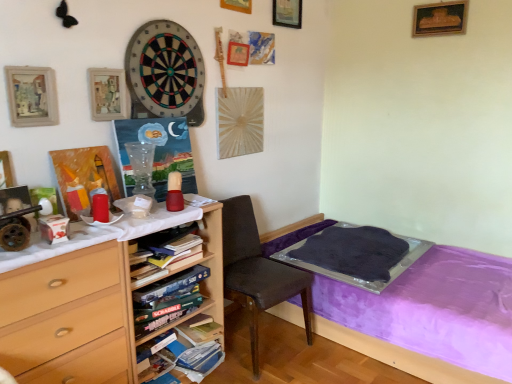
What is the approximate height of brown fabric chair at center?

The height of brown fabric chair at center is 30.53 inches.

This screenshot has width=512, height=384. Describe the element at coordinates (195, 348) in the screenshot. I see `hardcover book at center, which is counted as the second book, starting from the top` at that location.

Find the location of a particular element. The image size is (512, 384). wooden picture frame at upper right, which is counted as the 5th picture frame, starting from the left is located at coordinates tap(440, 18).

How different are the orientations of purple fabric bed at lower right and wooden picture frame at upper right, the fourth picture frame from the front, in degrees?

90.4 degrees.

From the image's perspective, which object appears higher, purple fabric bed at lower right or wooden picture frame at upper right, which is counted as the 5th picture frame, starting from the left?

From the image's view, wooden picture frame at upper right, which is counted as the 5th picture frame, starting from the left, is above.

Does purple fabric bed at lower right have a greater width compared to wooden picture frame at upper right, which is counted as the 5th picture frame, starting from the left?

Indeed, purple fabric bed at lower right has a greater width compared to wooden picture frame at upper right, which is counted as the 5th picture frame, starting from the left.

Is purple fabric bed at lower right at the right side of wooden picture frame at upper right, placed as the third picture frame when sorted from bottom to top?

Incorrect, purple fabric bed at lower right is not on the right side of wooden picture frame at upper right, placed as the third picture frame when sorted from bottom to top.

Which of these two, wooden picture frame at upper center, acting as the 3th picture frame starting from the left, or wooden desk at left, stands taller?

wooden desk at left is taller.

Consider the image. How far apart are wooden picture frame at upper center, the 4th picture frame ordered from the bottom, and wooden desk at left?

wooden picture frame at upper center, the 4th picture frame ordered from the bottom, and wooden desk at left are 5.52 feet apart from each other.

From a real-world perspective, is wooden picture frame at upper center, which is counted as the second picture frame, starting from the top, physically above wooden desk at left?

Yes, from a real-world perspective, wooden picture frame at upper center, which is counted as the second picture frame, starting from the top, is on top of wooden desk at left.

Considering the sizes of wooden picture frame at upper center, acting as the 3th picture frame starting from the left, and wooden desk at left in the image, is wooden picture frame at upper center, acting as the 3th picture frame starting from the left, wider or thinner than wooden desk at left?

In the image, wooden picture frame at upper center, acting as the 3th picture frame starting from the left, appears to be more narrow than wooden desk at left.

Is hardcover book at center, which is the first book from bottom to top, spatially inside wooden picture frame at upper left, the 5th picture frame from the back, or outside of it?

hardcover book at center, which is the first book from bottom to top, is spatially situated outside wooden picture frame at upper left, the 5th picture frame from the back.

Does hardcover book at center, which is the first book from bottom to top, have a lesser width compared to wooden picture frame at upper left, placed as the 1th picture frame when sorted from left to right?

In fact, hardcover book at center, which is the first book from bottom to top, might be wider than wooden picture frame at upper left, placed as the 1th picture frame when sorted from left to right.

How different are the orientations of hardcover book at center, which is counted as the second book, starting from the top, and wooden picture frame at upper left, acting as the 1th picture frame starting from the front, in degrees?

There is a 0.342-degree angle between the facing directions of hardcover book at center, which is counted as the second book, starting from the top, and wooden picture frame at upper left, acting as the 1th picture frame starting from the front.

Is hardcover book at center, which is counted as the second book, starting from the top, positioned with its back to wooden picture frame at upper left, acting as the 1th picture frame starting from the front?

No, hardcover book at center, which is counted as the second book, starting from the top, is not facing away from wooden picture frame at upper left, acting as the 1th picture frame starting from the front.

Does wooden picture frame at upper center, acting as the 3th picture frame starting from the left, have a greater height compared to soft felt dartboard at upper center?

No, wooden picture frame at upper center, acting as the 3th picture frame starting from the left, is not taller than soft felt dartboard at upper center.

Based on the photo, measure the distance from wooden picture frame at upper center, acting as the 3th picture frame starting from the left, to soft felt dartboard at upper center.

wooden picture frame at upper center, acting as the 3th picture frame starting from the left, is 21.66 inches away from soft felt dartboard at upper center.

Is wooden picture frame at upper center, the 3th picture frame positioned from the back, aimed at soft felt dartboard at upper center?

No, wooden picture frame at upper center, the 3th picture frame positioned from the back, is not aimed at soft felt dartboard at upper center.

Is point (165, 59) closer or farther from the camera than point (44, 100)?

Point (165, 59) is positioned farther from the camera compared to point (44, 100).

From a real-world perspective, is soft felt dartboard at upper center positioned over wooden picture frame at upper left, positioned as the 5th picture frame in top-to-bottom order, based on gravity?

Yes, from a real-world perspective, soft felt dartboard at upper center is on top of wooden picture frame at upper left, positioned as the 5th picture frame in top-to-bottom order.

Based on the photo, considering the relative positions of soft felt dartboard at upper center and wooden picture frame at upper left, acting as the 1th picture frame starting from the front, in the image provided, is soft felt dartboard at upper center behind wooden picture frame at upper left, acting as the 1th picture frame starting from the front,?

Yes, the depth of soft felt dartboard at upper center is greater than that of wooden picture frame at upper left, acting as the 1th picture frame starting from the front.

Measure the distance between soft felt dartboard at upper center and wooden picture frame at upper left, marked as the fifth picture frame in a right-to-left arrangement.

soft felt dartboard at upper center and wooden picture frame at upper left, marked as the fifth picture frame in a right-to-left arrangement, are 19.78 inches apart.

Does matte white box at left have a greater height compared to wooden desk at left?

No, matte white box at left is not taller than wooden desk at left.

Which point is more distant from viewer, (59, 224) or (156, 335)?

Point (156, 335)

In the scene shown: Based on their sizes in the image, would you say matte white box at left is bigger or smaller than wooden desk at left?

matte white box at left is smaller than wooden desk at left.

Image resolution: width=512 pixels, height=384 pixels. Find the location of `box above the wooden desk at left (from the image's perspective)`. box above the wooden desk at left (from the image's perspective) is located at coordinates (54, 228).

Which is closer to the camera, (432, 11) or (95, 277)?

Point (95, 277)

Is wooden picture frame at upper right, the second picture frame positioned from the back, facing away from wooden desk at left?

wooden picture frame at upper right, the second picture frame positioned from the back, does not have its back to wooden desk at left.

Can you tell me how much wooden picture frame at upper right, the fourth picture frame from the front, and wooden desk at left differ in facing direction?

The angle between the facing direction of wooden picture frame at upper right, the fourth picture frame from the front, and the facing direction of wooden desk at left is 90.8 degrees.

Is wooden picture frame at upper right, the second picture frame positioned from the back, to the left or to the right of wooden desk at left in the image?

wooden picture frame at upper right, the second picture frame positioned from the back, is positioned on wooden desk at left's right side.

In order to click on the 3rd picture frame located above the purple fabric bed at lower right (from a real-world perspective) in this screenshot , I will do `click(440, 18)`.

The width and height of the screenshot is (512, 384). Find the location of `desk that appears in front of the wooden picture frame at upper center, which appears as the 3th picture frame when viewed from the front`. desk that appears in front of the wooden picture frame at upper center, which appears as the 3th picture frame when viewed from the front is located at coordinates (71, 318).

From the image, which object appears to be nearer to matte white box at left, brown fabric chair at center or hardcover book at center, positioned as the 1th book in top-to-bottom order?

The object closer to matte white box at left is hardcover book at center, positioned as the 1th book in top-to-bottom order.

Estimate the real-world distances between objects in this image. Which object is closer to wooden picture frame at upper right, the third picture frame from the top, matte red bottle at center or wooden picture frame at upper left, the 5th picture frame from the back?

The object closer to wooden picture frame at upper right, the third picture frame from the top, is matte red bottle at center.

Based on the photo, which object lies further to the anchor point brown fabric chair at center, wooden picture frame at upper center, the 3th picture frame from the right, or matte wooden picture frame at upper left, the second picture frame when ordered from bottom to top?

wooden picture frame at upper center, the 3th picture frame from the right.

Looking at the image, which one is located closer to wooden picture frame at upper center, which appears as the 2th picture frame when viewed from the right, wooden picture frame at upper right, the second picture frame positioned from the back, or purple fabric bed at lower right?

wooden picture frame at upper right, the second picture frame positioned from the back, is closer to wooden picture frame at upper center, which appears as the 2th picture frame when viewed from the right.

From the image, which object appears to be farther from wooden picture frame at upper center, which appears as the 3th picture frame when viewed from the front, purple fabric bed at lower right or matte white box at left?

Based on the image, purple fabric bed at lower right appears to be further to wooden picture frame at upper center, which appears as the 3th picture frame when viewed from the front.

Considering their positions, is wooden picture frame at upper center, placed as the 4th picture frame when sorted from left to right, positioned further to wooden picture frame at upper left, the 5th picture frame from the back, than hardcover book at center, which is the first book from bottom to top?

wooden picture frame at upper center, placed as the 4th picture frame when sorted from left to right, is positioned further to the anchor wooden picture frame at upper left, the 5th picture frame from the back.

Estimate the real-world distances between objects in this image. Which object is further from wooden picture frame at upper left, the 5th picture frame from the back, wooden picture frame at upper center, the 5th picture frame in the bottom-to-top sequence, or wooden desk at left?

Based on the image, wooden picture frame at upper center, the 5th picture frame in the bottom-to-top sequence, appears to be further to wooden picture frame at upper left, the 5th picture frame from the back.

Which object lies further to the anchor point purple fabric bed at lower right, matte red bottle at center or wooden picture frame at upper center, acting as the 3th picture frame starting from the left?

wooden picture frame at upper center, acting as the 3th picture frame starting from the left, is positioned further to the anchor purple fabric bed at lower right.

Where is `bottle between wooden picture frame at upper center, which appears as the 2th picture frame when viewed from the right, and purple fabric bed at lower right, in the vertical direction`? bottle between wooden picture frame at upper center, which appears as the 2th picture frame when viewed from the right, and purple fabric bed at lower right, in the vertical direction is located at coordinates (174, 192).

Where is `box between soft felt dartboard at upper center and wooden desk at left in the up-down direction`? This screenshot has height=384, width=512. box between soft felt dartboard at upper center and wooden desk at left in the up-down direction is located at coordinates (54, 228).

The height and width of the screenshot is (384, 512). Identify the location of chair between matte red bottle at center and wooden picture frame at upper right, which is counted as the 5th picture frame, starting from the left, in the horizontal direction. (258, 271).

The image size is (512, 384). In order to click on box between wooden picture frame at upper left, positioned as the 5th picture frame in top-to-bottom order, and hardcover book at center, which is the first book from bottom to top, in the vertical direction in this screenshot , I will do `click(54, 228)`.